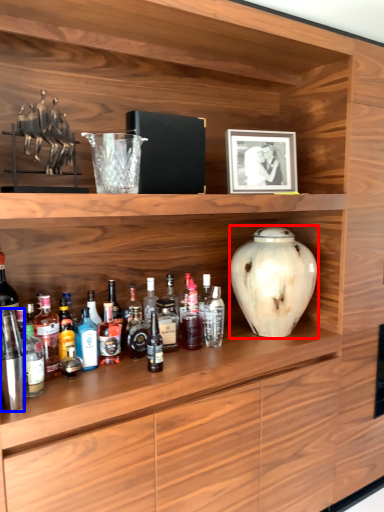
Question: Which object is closer to the camera taking this photo, vase (highlighted by a red box) or bottle (highlighted by a blue box)?

Choices:
 (A) vase
 (B) bottle

Answer: (B)